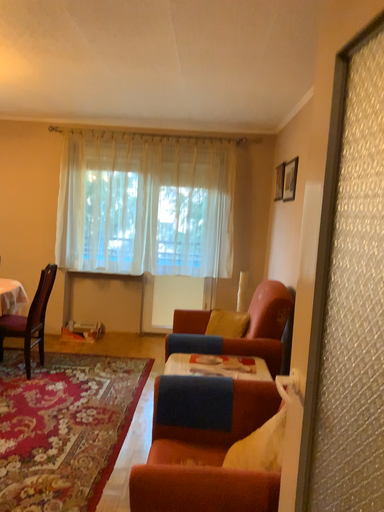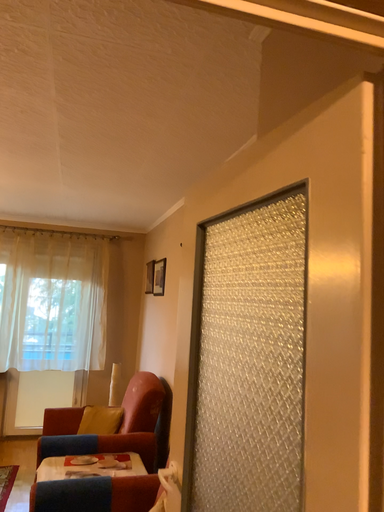
Question: How did the camera likely rotate when shooting the video?

Choices:
 (A) rotated downward
 (B) rotated upward

Answer: (B)